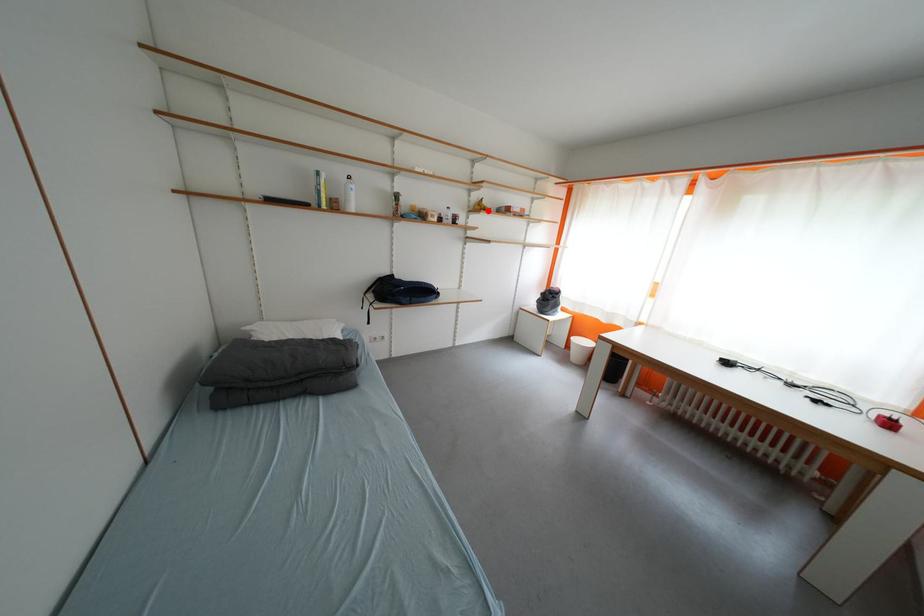
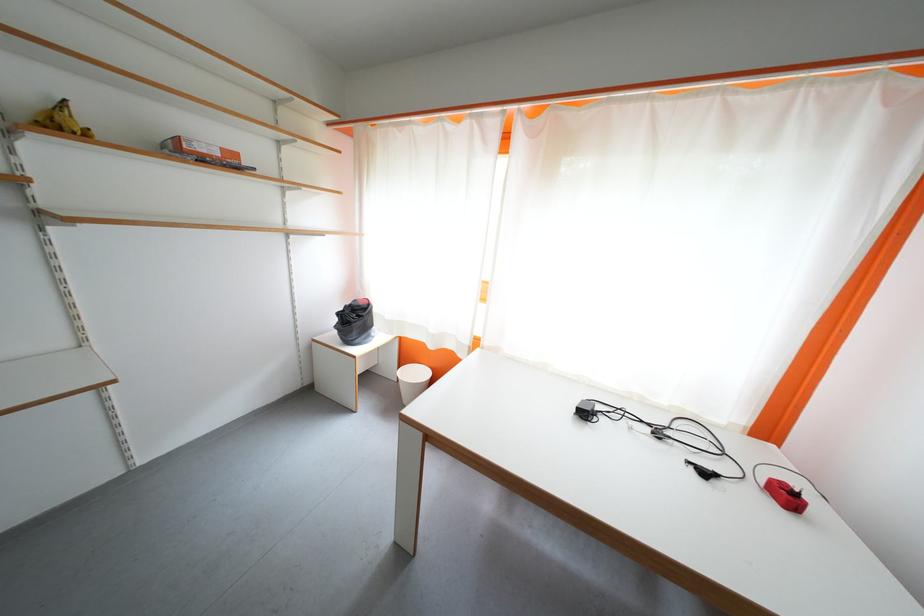
Question: A red point is marked in image1. In image2, is the corresponding 3D point closer to the camera or farther? Reply with the corresponding letter.

Choices:
 (A) The corresponding 3D point is closer.
 (B) The corresponding 3D point is farther.

Answer: (B)